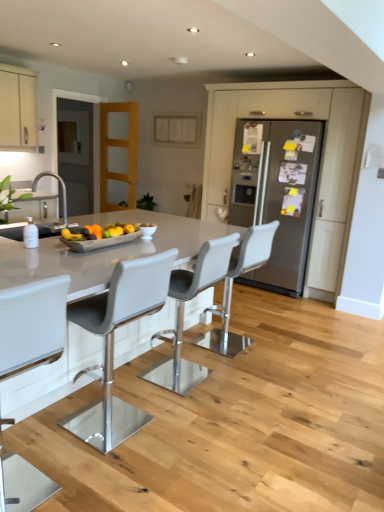
Question: Is white leather bar stool at center, positioned as the fourth chair in back-to-front order, positioned with its back to matte gray refrigerator at center, placed as the third cabinetry when sorted from left to right?

Choices:
 (A) no
 (B) yes

Answer: (A)

Question: Is matte gray refrigerator at center, placed as the third cabinetry when sorted from left to right, located within white leather bar stool at center, positioned as the fourth chair in back-to-front order?

Choices:
 (A) no
 (B) yes

Answer: (A)

Question: Considering the relative sizes of white leather bar stool at center, acting as the 1th chair starting from the front, and matte gray refrigerator at center, placed as the third cabinetry when sorted from left to right, in the image provided, is white leather bar stool at center, acting as the 1th chair starting from the front, taller than matte gray refrigerator at center, placed as the third cabinetry when sorted from left to right,?

Choices:
 (A) yes
 (B) no

Answer: (B)

Question: From the image's perspective, is white leather bar stool at center, acting as the 1th chair starting from the front, on top of matte gray refrigerator at center, placed as the third cabinetry when sorted from left to right?

Choices:
 (A) no
 (B) yes

Answer: (A)

Question: Considering the relative sizes of white leather bar stool at center, positioned as the fourth chair in back-to-front order, and matte gray refrigerator at center, placed as the third cabinetry when sorted from left to right, in the image provided, is white leather bar stool at center, positioned as the fourth chair in back-to-front order, smaller than matte gray refrigerator at center, placed as the third cabinetry when sorted from left to right,?

Choices:
 (A) yes
 (B) no

Answer: (A)

Question: From a real-world perspective, is white leather bar stool at center, positioned as the fourth chair in back-to-front order, positioned over matte gray refrigerator at center, placed as the third cabinetry when sorted from left to right, based on gravity?

Choices:
 (A) yes
 (B) no

Answer: (B)

Question: Is matte gray tray at center shorter than matte gray refrigerator at center, the first cabinetry in the right-to-left sequence?

Choices:
 (A) no
 (B) yes

Answer: (B)

Question: Is matte gray tray at center turned away from matte gray refrigerator at center, placed as the third cabinetry when sorted from left to right?

Choices:
 (A) no
 (B) yes

Answer: (A)

Question: Is matte gray tray at center closer to the viewer compared to matte gray refrigerator at center, placed as the third cabinetry when sorted from left to right?

Choices:
 (A) yes
 (B) no

Answer: (A)

Question: From the image's perspective, is matte gray tray at center below matte gray refrigerator at center, placed as the third cabinetry when sorted from left to right?

Choices:
 (A) no
 (B) yes

Answer: (B)

Question: From a real-world perspective, is matte gray tray at center located beneath matte gray refrigerator at center, the first cabinetry in the right-to-left sequence?

Choices:
 (A) no
 (B) yes

Answer: (B)

Question: Is the position of matte gray tray at center more distant than that of matte gray refrigerator at center, placed as the third cabinetry when sorted from left to right?

Choices:
 (A) yes
 (B) no

Answer: (B)

Question: From a real-world perspective, is white leather bar stool at center, the second chair in the back-to-front sequence, on top of transparent glass door at left?

Choices:
 (A) no
 (B) yes

Answer: (A)